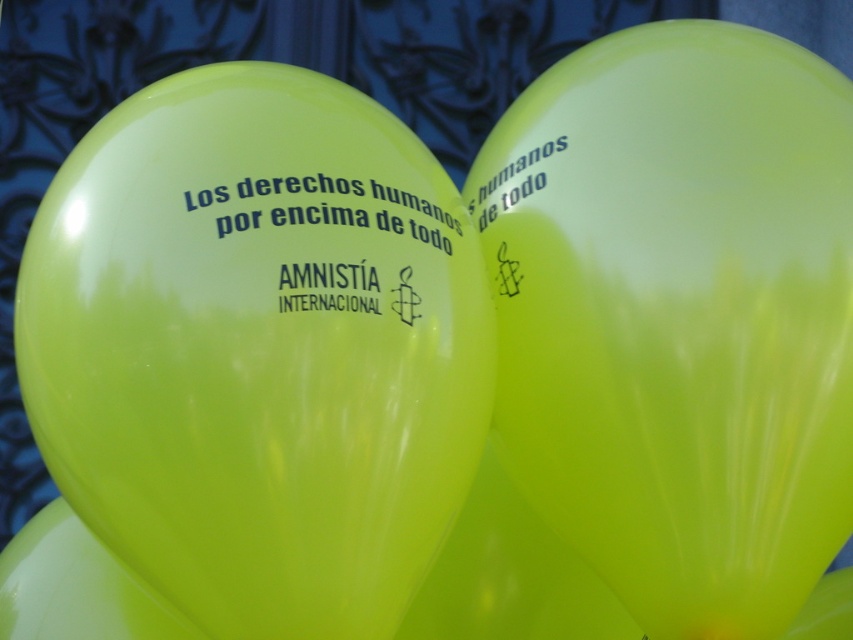
Question: Is lime matte balloon at center behind green glossy balloon at center?

Choices:
 (A) yes
 (B) no

Answer: (A)

Question: Which of the following is the farthest from the observer?

Choices:
 (A) green glossy balloon at center
 (B) lime green latex balloon at center
 (C) lime matte balloon at center

Answer: (C)

Question: Does lime matte balloon at center appear on the left side of green glossy balloon at upper right?

Choices:
 (A) no
 (B) yes

Answer: (A)

Question: Is lime green latex balloon at center behind green glossy balloon at upper right?

Choices:
 (A) yes
 (B) no

Answer: (B)

Question: Which object appears farthest from the camera in this image?

Choices:
 (A) lime green latex balloon at center
 (B) lime matte balloon at center

Answer: (B)

Question: Which object appears farthest from the camera in this image?

Choices:
 (A) lime green latex balloon at center
 (B) green glossy balloon at center
 (C) green glossy balloon at upper right

Answer: (C)